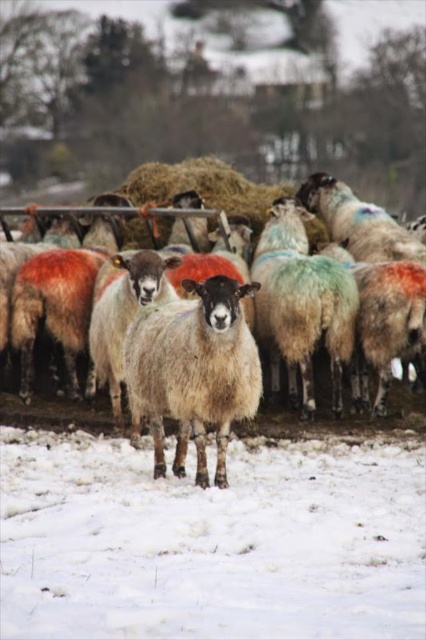
You are a farmer trying to locate the fuzzy woolly sheep at center in a snowy field. Using a coordinate system where the bottom left corner is the origin, can you determine its position?

The fuzzy woolly sheep at center is located at point (x=193, y=371).

You are a farmer trying to locate your sheep in the snowy field. You notice two sheep at the center of the image. Which one is closer to you, the white woolen sheep at center or the fuzzy woolen sheep at center?

The white woolen sheep at center is closer to you because the fuzzy woolen sheep at center is behind it.